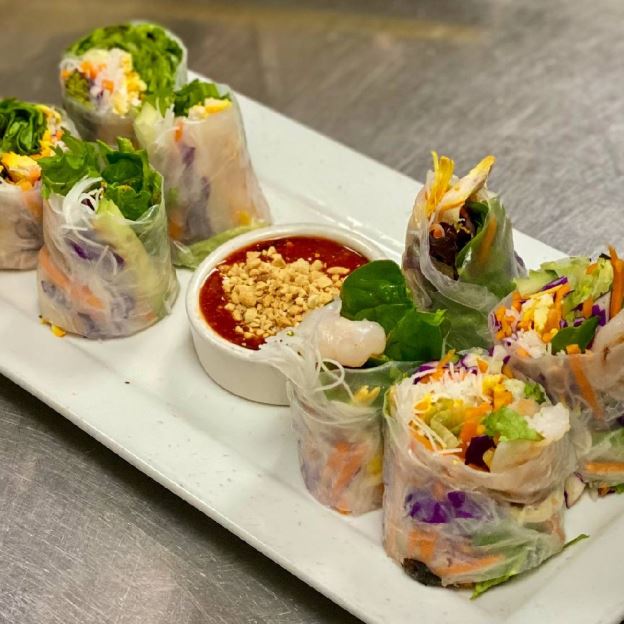
Locate an element on the screen. wood table is located at coordinates (139, 586).